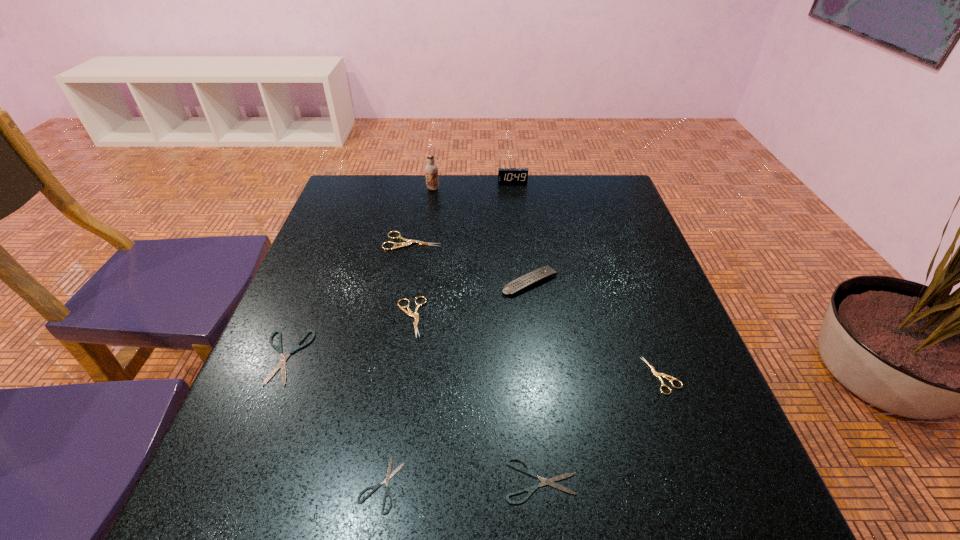
The width and height of the screenshot is (960, 540). I want to click on blank space located on the left of the third tallest object, so click(x=434, y=282).

Identify the location of vacant area situated 0.110m on the front of the tallest shears. The width and height of the screenshot is (960, 540). (405, 280).

The image size is (960, 540). I want to click on vacant space situated 0.180m on the front of the second tallest shears, so click(395, 417).

Locate an element on the screen. free space located on the front of the leftmost shears is located at coordinates (238, 472).

Identify the location of free space located 0.370m on the back of the rightmost shears. Image resolution: width=960 pixels, height=540 pixels. (613, 244).

The image size is (960, 540). Find the location of `vacant area situated on the right of the second shears from right to left`. vacant area situated on the right of the second shears from right to left is located at coordinates (722, 481).

I want to click on vacant space located 0.100m on the left of the second black shears from right to left, so click(x=297, y=484).

The image size is (960, 540). In order to click on chocolate milk present at the far edge in this screenshot , I will do `click(431, 169)`.

Find the location of a particular element. The image size is (960, 540). alarm clock present at the far edge is located at coordinates (505, 175).

You are a GUI agent. You are given a task and a screenshot of the screen. Output one action in this format:
    pyautogui.click(x=<x>, y=<y>)
    Task: Click on the object that is at the left edge
    This screenshot has height=540, width=960.
    Given the screenshot: What is the action you would take?
    pyautogui.click(x=281, y=364)